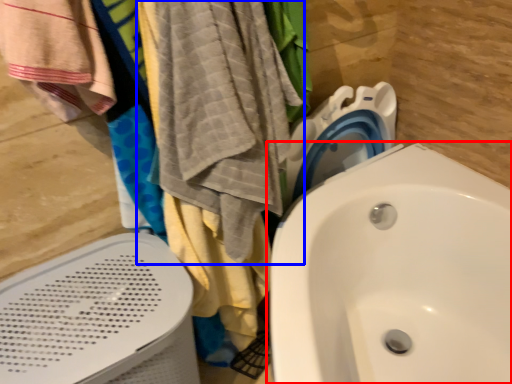
Question: Which of the following is the farthest to the observer, sink (highlighted by a red box) or beach towel (highlighted by a blue box)?

Choices:
 (A) sink
 (B) beach towel

Answer: (B)